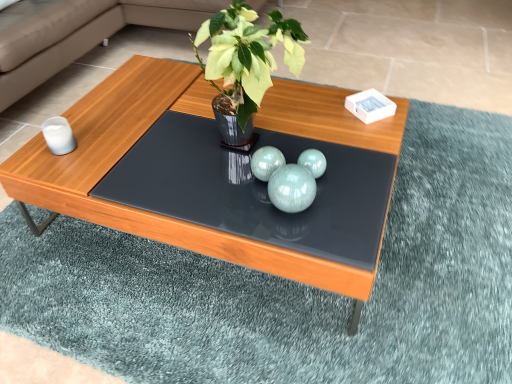
The width and height of the screenshot is (512, 384). In order to click on vacant space underneath shiny black glass table at center (from a real-world perspective) in this screenshot , I will do `click(234, 188)`.